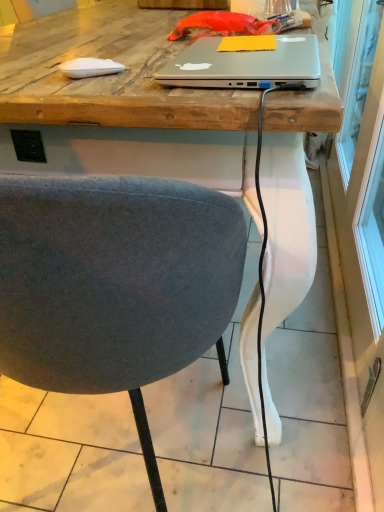
Question: Visually, is transparent glass screen door at right positioned to the left or to the right of satin silver laptop at center?

Choices:
 (A) right
 (B) left

Answer: (A)

Question: From their relative heights in the image, would you say transparent glass screen door at right is taller or shorter than satin silver laptop at center?

Choices:
 (A) tall
 (B) short

Answer: (A)

Question: Estimate the real-world distances between objects in this image. Which object is farther from the transparent glass screen door at right?

Choices:
 (A) satin silver laptop at center
 (B) textured gray chair at center

Answer: (A)

Question: Which of these objects is positioned closest to the transparent glass screen door at right?

Choices:
 (A) satin silver laptop at center
 (B) textured gray chair at center

Answer: (B)